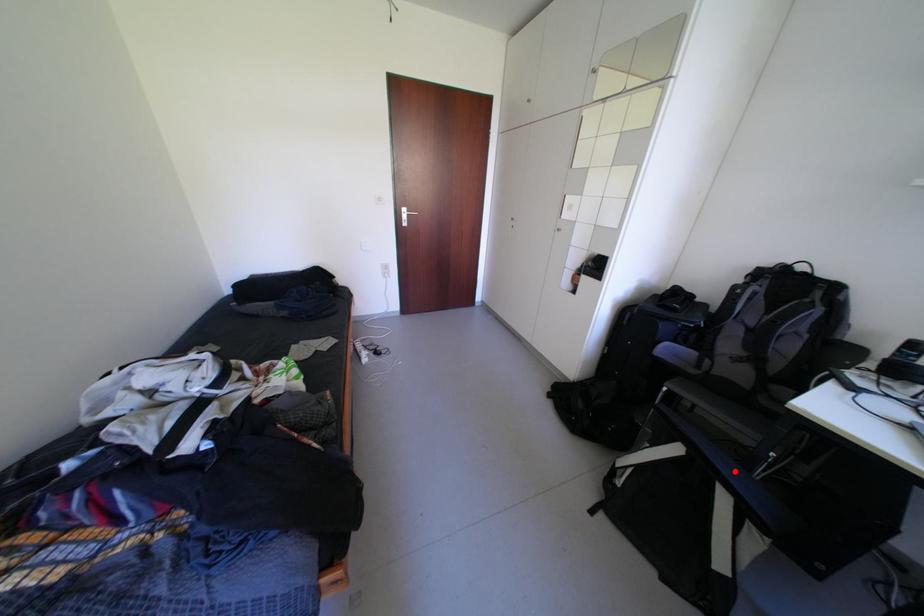
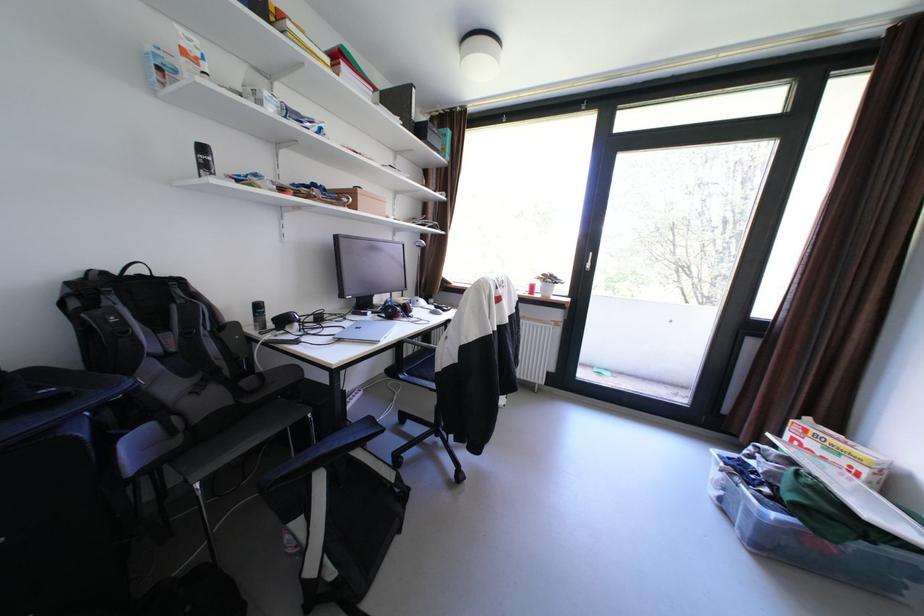
Question: I am providing you with two images of the same scene from different viewpoints. A red point is shown in image1. For the corresponding object point in image2, is it positioned nearer or farther from the camera?

Choices:
 (A) Nearer
 (B) Farther

Answer: (A)